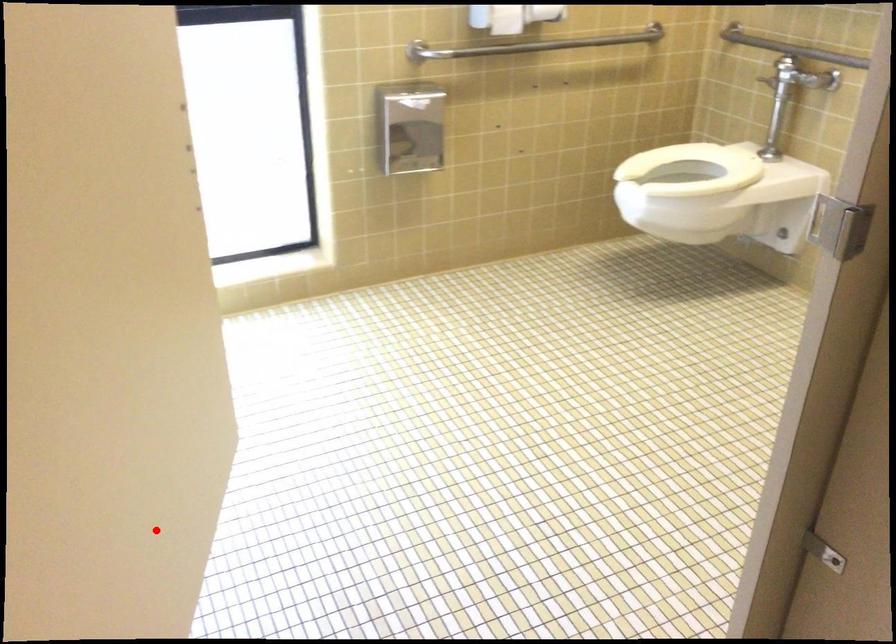
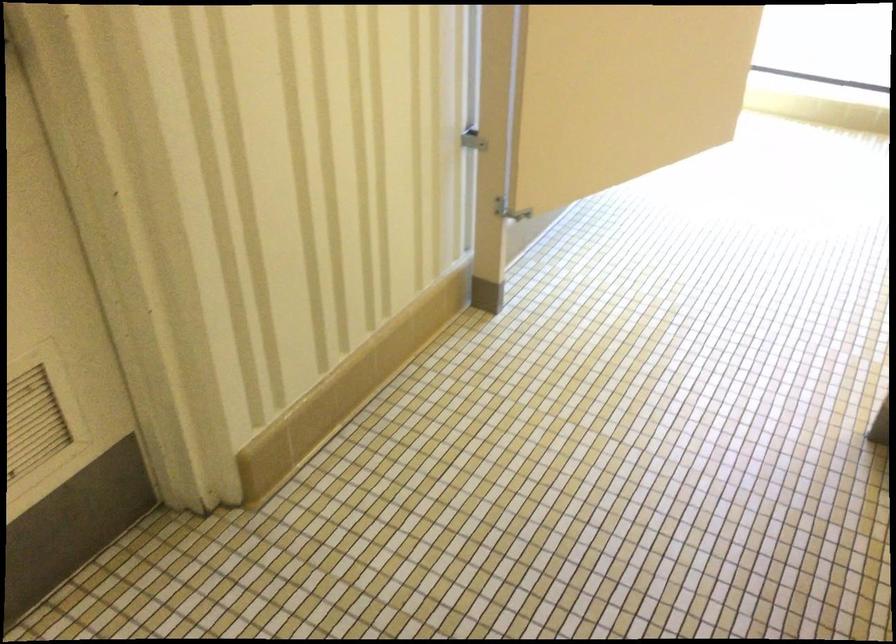
Question: I am providing you with two images of the same scene from different viewpoints. Given a red point in image1, look at the same physical point in image2. Is it:

Choices:
 (A) Closer to the viewpoint
 (B) Farther from the viewpoint

Answer: (B)